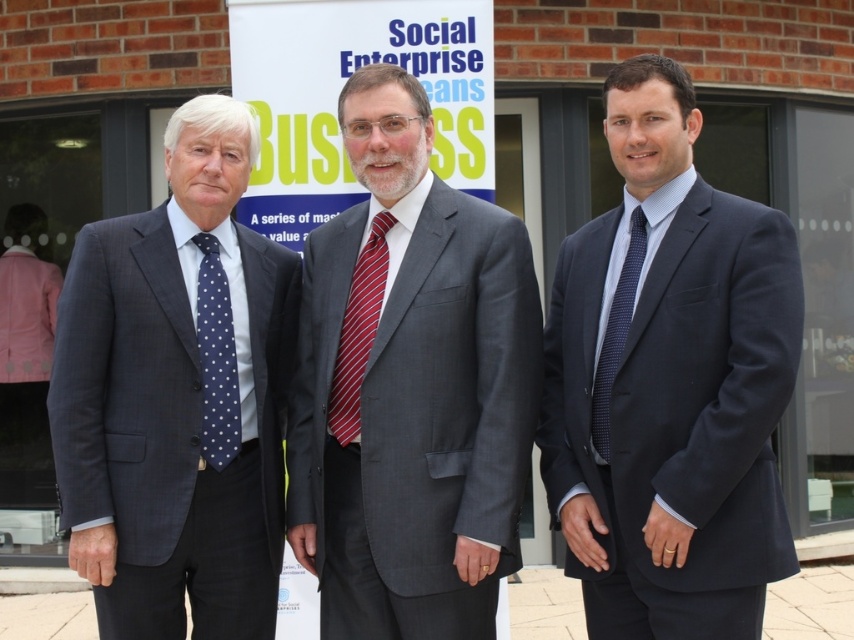
Question: Is gray suit at center wider than matte blue suit at left?

Choices:
 (A) no
 (B) yes

Answer: (B)

Question: In this image, where is matte blue suit at left located relative to red striped tie at center?

Choices:
 (A) above
 (B) below

Answer: (B)

Question: Estimate the real-world distances between objects in this image. Which object is closer to the matte blue suit at right?

Choices:
 (A) matte blue suit at left
 (B) navy dotted tie at left
 (C) gray suit at center
 (D) red striped tie at center

Answer: (C)

Question: Is the position of matte blue suit at left more distant than that of navy dotted tie at left?

Choices:
 (A) yes
 (B) no

Answer: (B)

Question: Which point appears farthest from the camera in this image?

Choices:
 (A) (352, 310)
 (B) (276, 506)
 (C) (460, 572)

Answer: (B)

Question: Estimate the real-world distances between objects in this image. Which object is closer to the matte blue suit at left?

Choices:
 (A) red striped tie at center
 (B) gray suit at center
 (C) navy dotted tie at left
 (D) matte blue suit at right

Answer: (C)